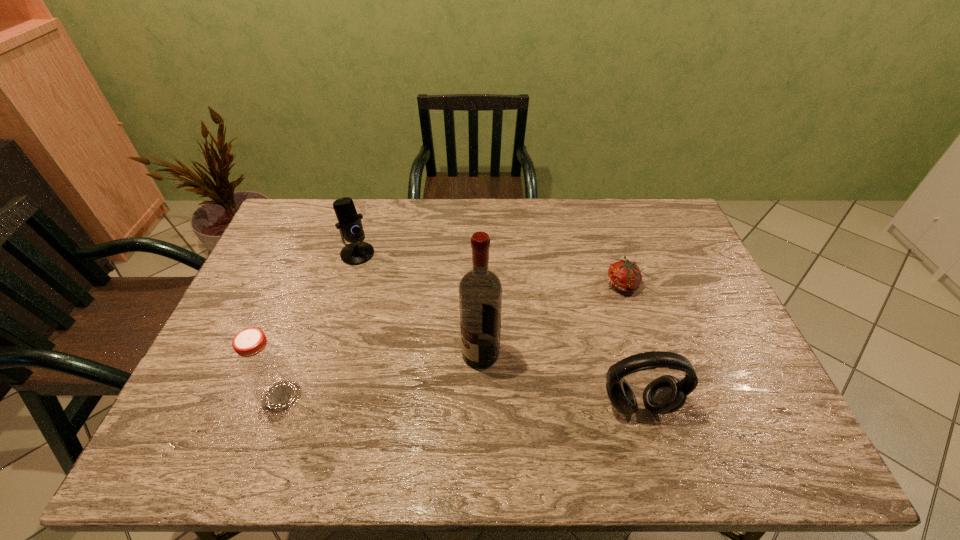
Where is `unoccupied area between the headset and the bottle`? unoccupied area between the headset and the bottle is located at coordinates (460, 401).

The width and height of the screenshot is (960, 540). Find the location of `free area in between the tomato and the headset`. free area in between the tomato and the headset is located at coordinates (631, 345).

The height and width of the screenshot is (540, 960). What are the coordinates of `the third closest object to the third object from left to right` in the screenshot? It's located at (263, 366).

You are a GUI agent. You are given a task and a screenshot of the screen. Output one action in this format:
    pyautogui.click(x=<x>, y=<y>)
    Task: Click on the object identified as the closest to the tomato
    The height and width of the screenshot is (540, 960).
    Given the screenshot: What is the action you would take?
    pyautogui.click(x=666, y=394)

Find the location of `free region that satisfies the following two spatial constraints: 1. on the back side of the microphone; 2. on the left side of the bottle`. free region that satisfies the following two spatial constraints: 1. on the back side of the microphone; 2. on the left side of the bottle is located at coordinates 332,254.